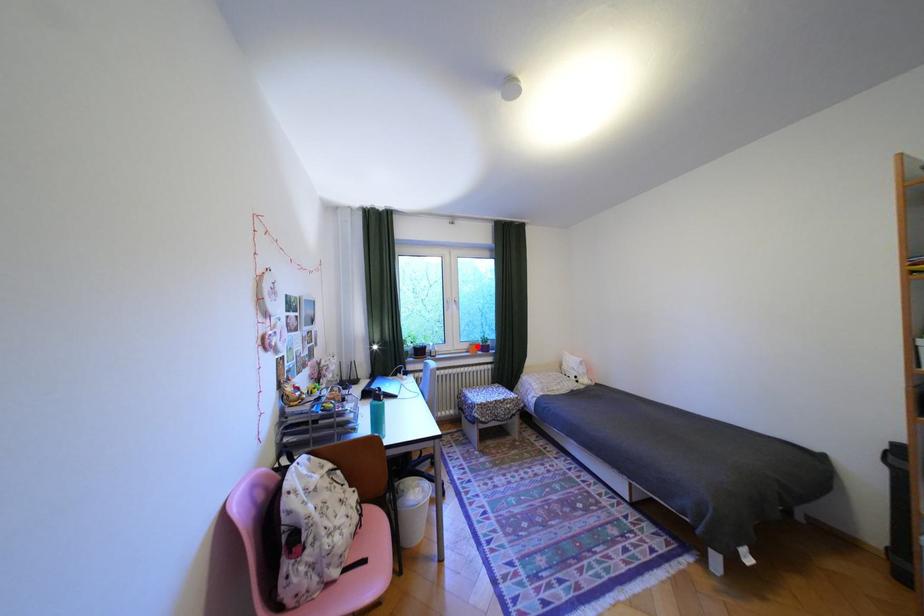
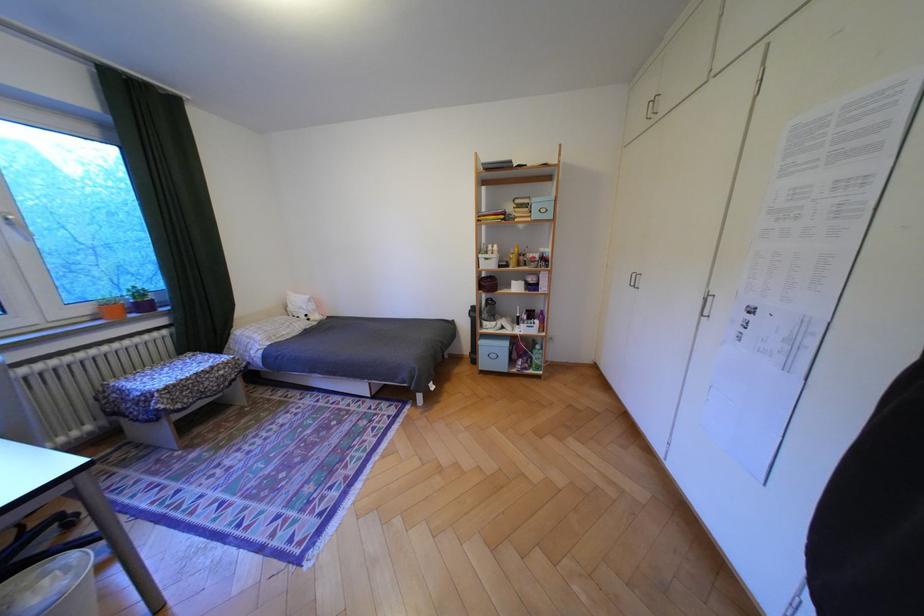
Question: I am providing you with two images of the same scene from different viewpoints. Given a red point in image1, look at the same physical point in image2. Is it:

Choices:
 (A) Closer to the viewpoint
 (B) Farther from the viewpoint

Answer: (A)